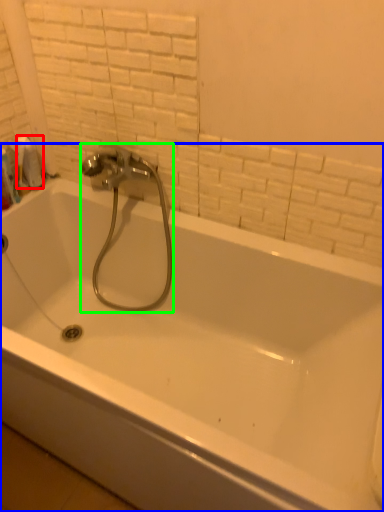
Question: Based on their relative distances, which object is farther from toilet paper (highlighted by a red box)? Choose from bathtub (highlighted by a blue box) and plumbing fixture (highlighted by a green box).

Choices:
 (A) bathtub
 (B) plumbing fixture

Answer: (A)